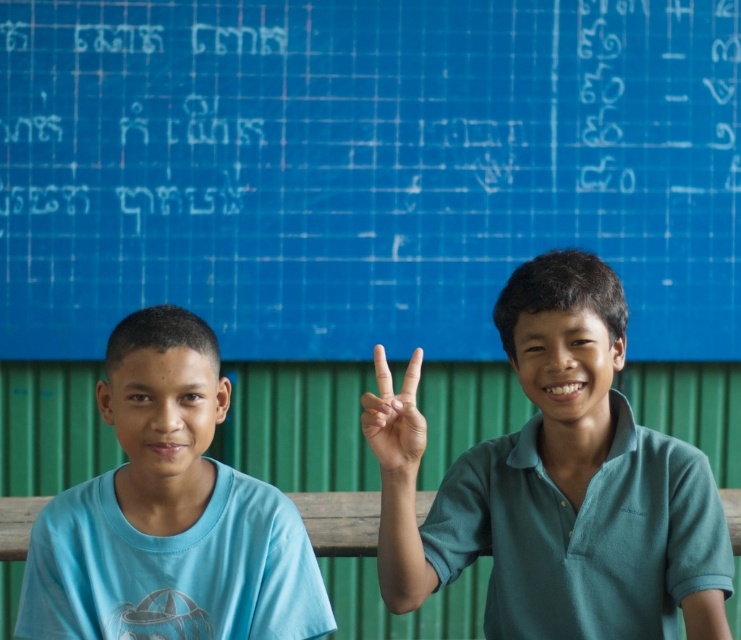
In the scene shown: Who is higher up, blue matte/blackboard at upper center or smooth skin hand at center?

blue matte/blackboard at upper center is higher up.

The height and width of the screenshot is (640, 741). Find the location of `blue matte/blackboard at upper center`. blue matte/blackboard at upper center is located at coordinates (365, 168).

Describe the element at coordinates (365, 168) in the screenshot. The image size is (741, 640). I see `blue matte/blackboard at upper center` at that location.

Locate an element on the screen. The height and width of the screenshot is (640, 741). blue matte/blackboard at upper center is located at coordinates (365, 168).

Which is more to the right, blue cotton shirt at left or smooth skin hand at center?

Positioned to the right is smooth skin hand at center.

Which of these two, blue cotton shirt at left or smooth skin hand at center, stands shorter?

smooth skin hand at center

Describe the element at coordinates (169, 515) in the screenshot. I see `blue cotton shirt at left` at that location.

Image resolution: width=741 pixels, height=640 pixels. I want to click on blue cotton shirt at left, so click(x=169, y=515).

Is teal matte shirt at center thinner than smooth skin hand at center?

Incorrect, teal matte shirt at center's width is not less than smooth skin hand at center's.

Based on the photo, measure the distance from teal matte shirt at center to smooth skin hand at center.

7.33 inches

You are a GUI agent. You are given a task and a screenshot of the screen. Output one action in this format:
    pyautogui.click(x=<x>, y=<y>)
    Task: Click on the teal matte shirt at center
    
    Given the screenshot: What is the action you would take?
    pyautogui.click(x=554, y=483)

Identify the location of teal matte shirt at center. (554, 483).